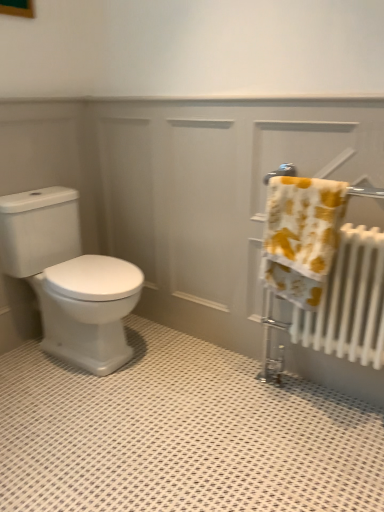
Question: Considering the relative sizes of white glossy radiator at right and yellow printed towel at right in the image provided, is white glossy radiator at right wider than yellow printed towel at right?

Choices:
 (A) no
 (B) yes

Answer: (A)

Question: Is the position of white glossy radiator at right more distant than that of yellow printed towel at right?

Choices:
 (A) yes
 (B) no

Answer: (A)

Question: Does white glossy radiator at right appear on the left side of yellow printed towel at right?

Choices:
 (A) yes
 (B) no

Answer: (A)

Question: Could you tell me if white glossy radiator at right is facing yellow printed towel at right?

Choices:
 (A) yes
 (B) no

Answer: (A)

Question: Is white glossy radiator at right positioned in front of yellow printed towel at right?

Choices:
 (A) no
 (B) yes

Answer: (A)

Question: Is white glossy radiator at right facing away from yellow printed towel at right?

Choices:
 (A) no
 (B) yes

Answer: (B)

Question: Are yellow printed towel at right and white glossy radiator at right beside each other?

Choices:
 (A) yes
 (B) no

Answer: (B)

Question: Can you confirm if yellow printed towel at right is shorter than white glossy radiator at right?

Choices:
 (A) no
 (B) yes

Answer: (B)

Question: Is white glossy radiator at right a part of yellow printed towel at right?

Choices:
 (A) yes
 (B) no

Answer: (B)

Question: Is yellow printed towel at right positioned behind white glossy radiator at right?

Choices:
 (A) yes
 (B) no

Answer: (B)

Question: Is yellow printed towel at right thinner than white glossy radiator at right?

Choices:
 (A) yes
 (B) no

Answer: (B)

Question: Does yellow printed towel at right have a greater height compared to white glossy radiator at right?

Choices:
 (A) yes
 (B) no

Answer: (B)

Question: Is white glossy toilet at left outside yellow printed towel at right?

Choices:
 (A) no
 (B) yes

Answer: (B)